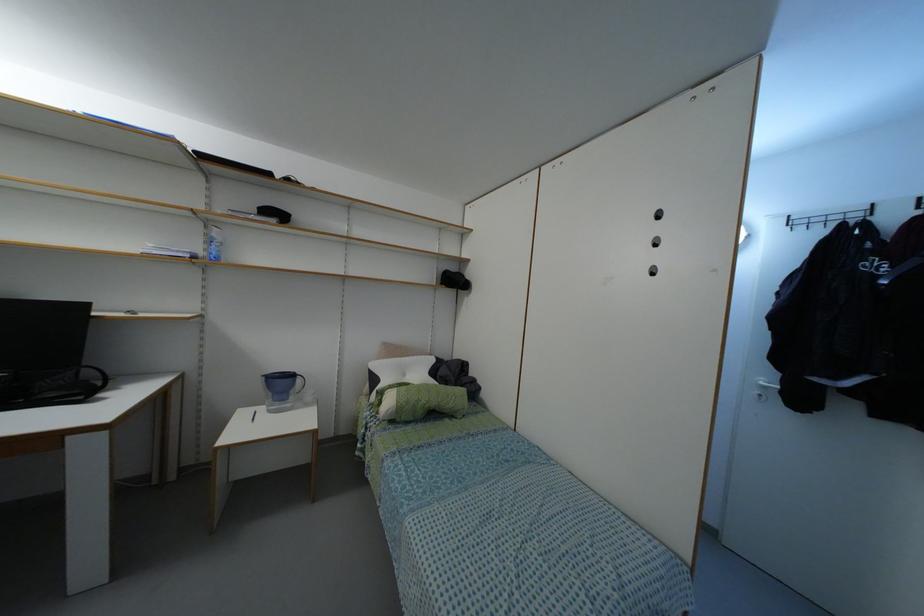
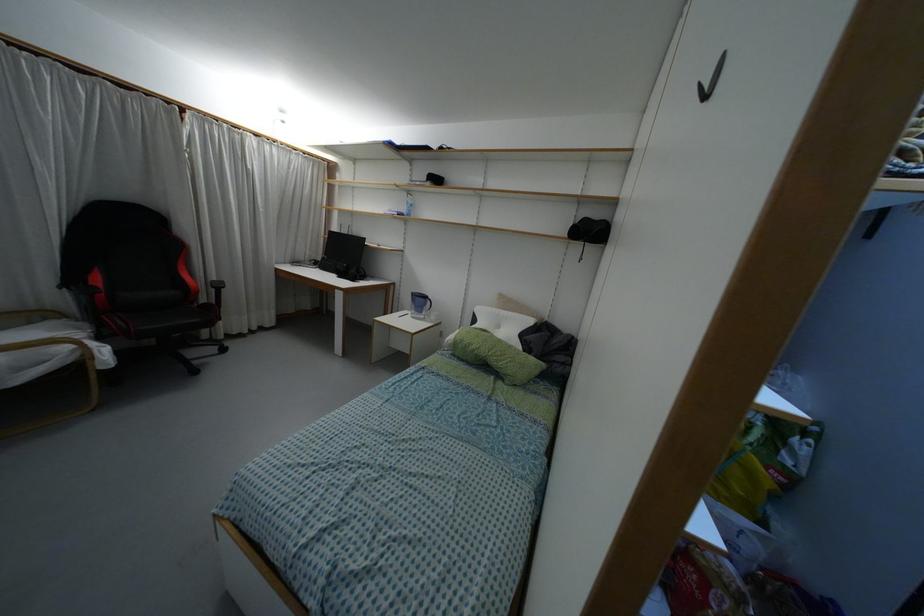
Locate, in the second image, the point that corresponds to pixel 397 359 in the first image.

(496, 310)